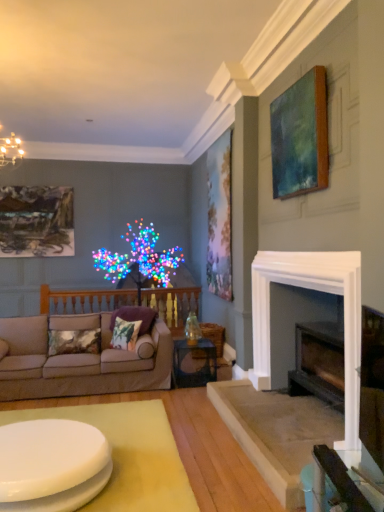
Describe the element at coordinates (219, 217) in the screenshot. The height and width of the screenshot is (512, 384). I see `matte green painting at upper right, which appears as the second picture frame when viewed from the back` at that location.

This screenshot has height=512, width=384. Describe the element at coordinates (74, 341) in the screenshot. I see `textured velvet pillow at lower left, arranged as the 3th pillow when viewed from the right` at that location.

The image size is (384, 512). In order to click on beige fabric couch at left in this screenshot , I will do `click(79, 360)`.

Where is `greenish-blue canvas at upper right, which is the 3th picture frame in left-to-right order`? greenish-blue canvas at upper right, which is the 3th picture frame in left-to-right order is located at coordinates [300, 137].

Who is more distant, green printed fabric pillow at center, which is the second pillow in right-to-left order, or oil painting at upper left, which ranks as the third picture frame in front-to-back order?

Positioned behind is oil painting at upper left, which ranks as the third picture frame in front-to-back order.

From the green printed fabric pillow at center, which is the second pillow in right-to-left order, count 2nd picture frames backward and point to it. Please provide its 2D coordinates.

[(36, 221)]

Does point (112, 341) come closer to viewer compared to point (38, 203)?

Yes, point (112, 341) is in front of point (38, 203).

From the picture: Who is shorter, green printed fabric pillow at center, which ranks as the 2th pillow in left-to-right order, or oil painting at upper left, which ranks as the third picture frame in front-to-back order?

green printed fabric pillow at center, which ranks as the 2th pillow in left-to-right order.

Can you confirm if clear glass table at center is taller than beige fabric couch at left?

Incorrect, the height of clear glass table at center is not larger of that of beige fabric couch at left.

Is clear glass table at center looking in the opposite direction of beige fabric couch at left?

No, clear glass table at center is not facing away from beige fabric couch at left.

Is clear glass table at center at the right side of beige fabric couch at left?

Yes.

Does matte green painting at upper right, which is counted as the second picture frame, starting from the left, come behind clear glass table at center?

Yes.

Who is smaller, matte green painting at upper right, which is counted as the second picture frame, starting from the left, or clear glass table at center?

clear glass table at center is smaller.

Could you measure the distance between matte green painting at upper right, marked as the 2th picture frame in a front-to-back arrangement, and clear glass table at center?

matte green painting at upper right, marked as the 2th picture frame in a front-to-back arrangement, is 4.51 feet away from clear glass table at center.

From a real-world perspective, which is physically below, matte green painting at upper right, positioned as the second picture frame in right-to-left order, or clear glass table at center?

clear glass table at center, from a real-world perspective.

Considering the points (201, 369) and (286, 146), which point is behind, point (201, 369) or point (286, 146)?

The point (201, 369) is farther.

Is clear glass table at center not inside greenish-blue canvas at upper right, which is the 1th picture frame in front-to-back order?

Yes, clear glass table at center is outside of greenish-blue canvas at upper right, which is the 1th picture frame in front-to-back order.

Considering the relative sizes of purple velvet pillow at center, placed as the 1th pillow when sorted from right to left, and green printed fabric pillow at center, which is the second pillow in right-to-left order, in the image provided, is purple velvet pillow at center, placed as the 1th pillow when sorted from right to left, smaller than green printed fabric pillow at center, which is the second pillow in right-to-left order,?

No, purple velvet pillow at center, placed as the 1th pillow when sorted from right to left, is not smaller than green printed fabric pillow at center, which is the second pillow in right-to-left order.

This screenshot has width=384, height=512. I want to click on pillow that is the 1st object to the left of the purple velvet pillow at center, the 3th pillow viewed from the left, starting at the anchor, so click(x=125, y=334).

Considering the relative sizes of purple velvet pillow at center, the 3th pillow viewed from the left, and green printed fabric pillow at center, which is the second pillow in right-to-left order, in the image provided, is purple velvet pillow at center, the 3th pillow viewed from the left, taller than green printed fabric pillow at center, which is the second pillow in right-to-left order,?

Correct, purple velvet pillow at center, the 3th pillow viewed from the left, is much taller as green printed fabric pillow at center, which is the second pillow in right-to-left order.

From a real-world perspective, is purple velvet pillow at center, placed as the 1th pillow when sorted from right to left, positioned under green printed fabric pillow at center, which ranks as the 2th pillow in left-to-right order, based on gravity?

No, from a real-world perspective, purple velvet pillow at center, placed as the 1th pillow when sorted from right to left, is not under green printed fabric pillow at center, which ranks as the 2th pillow in left-to-right order.

Would you say white glossy coffee table at center is inside or outside matte green painting at upper right, marked as the 2th picture frame in a front-to-back arrangement?

white glossy coffee table at center lies outside matte green painting at upper right, marked as the 2th picture frame in a front-to-back arrangement.

Between white glossy coffee table at center and matte green painting at upper right, positioned as the second picture frame in right-to-left order, which one has larger width?

Wider between the two is white glossy coffee table at center.

How different are the orientations of white glossy coffee table at center and matte green painting at upper right, which is counted as the second picture frame, starting from the left, in degrees?

They differ by 1.23 degrees in their facing directions.

How many degrees apart are the facing directions of purple velvet pillow at center, the 3th pillow viewed from the left, and greenish-blue canvas at upper right, which is the 3th picture frame in left-to-right order?

The angular difference between purple velvet pillow at center, the 3th pillow viewed from the left, and greenish-blue canvas at upper right, which is the 3th picture frame in left-to-right order, is 59 degrees.

Considering the points (131, 309) and (312, 184), which point is behind, point (131, 309) or point (312, 184)?

The point (131, 309) is behind.

Image resolution: width=384 pixels, height=512 pixels. I want to click on pillow that is the 1st object located below the greenish-blue canvas at upper right, which is the 1th picture frame in front-to-back order (from the image's perspective), so click(x=135, y=317).

Does purple velvet pillow at center, placed as the 1th pillow when sorted from right to left, have a lesser width compared to greenish-blue canvas at upper right, which is the third picture frame in back-to-front order?

Incorrect, the width of purple velvet pillow at center, placed as the 1th pillow when sorted from right to left, is not less than that of greenish-blue canvas at upper right, which is the third picture frame in back-to-front order.

Where is `picture frame to the left of green printed fabric pillow at center, which ranks as the 2th pillow in left-to-right order`? picture frame to the left of green printed fabric pillow at center, which ranks as the 2th pillow in left-to-right order is located at coordinates (36, 221).

The width and height of the screenshot is (384, 512). Find the location of `studio couch above the clear glass table at center (from the image's perspective)`. studio couch above the clear glass table at center (from the image's perspective) is located at coordinates (79, 360).

Estimate the real-world distances between objects in this image. Which object is closer to white glossy coffee table at center, purple velvet pillow at center, placed as the 1th pillow when sorted from right to left, or beige fabric couch at left?

The object closer to white glossy coffee table at center is beige fabric couch at left.

In the scene shown: Based on their spatial positions, is purple velvet pillow at center, placed as the 1th pillow when sorted from right to left, or green printed fabric pillow at center, which ranks as the 2th pillow in left-to-right order, further from greenish-blue canvas at upper right, which is the 1th picture frame in front-to-back order?

green printed fabric pillow at center, which ranks as the 2th pillow in left-to-right order, is further to greenish-blue canvas at upper right, which is the 1th picture frame in front-to-back order.

Which object lies further to the anchor point greenish-blue canvas at upper right, which is the 3th picture frame in left-to-right order, textured velvet pillow at lower left, arranged as the 3th pillow when viewed from the right, or green printed fabric pillow at center, which ranks as the 2th pillow in left-to-right order?

textured velvet pillow at lower left, arranged as the 3th pillow when viewed from the right, lies further to greenish-blue canvas at upper right, which is the 3th picture frame in left-to-right order, than the other object.

Based on the photo, estimate the real-world distances between objects in this image. Which object is further from matte green painting at upper right, which is counted as the second picture frame, starting from the left, purple velvet pillow at center, the 3th pillow viewed from the left, or white glossy coffee table at center?

white glossy coffee table at center lies further to matte green painting at upper right, which is counted as the second picture frame, starting from the left, than the other object.

From the image, which object appears to be farther from matte green painting at upper right, which appears as the second picture frame when viewed from the back, beige fabric couch at left or textured velvet pillow at lower left, arranged as the 3th pillow when viewed from the right?

The object further to matte green painting at upper right, which appears as the second picture frame when viewed from the back, is textured velvet pillow at lower left, arranged as the 3th pillow when viewed from the right.

Based on their spatial positions, is textured velvet pillow at lower left, arranged as the 3th pillow when viewed from the right, or clear glass table at center further from matte green painting at upper right, positioned as the second picture frame in right-to-left order?

Among the two, textured velvet pillow at lower left, arranged as the 3th pillow when viewed from the right, is located further to matte green painting at upper right, positioned as the second picture frame in right-to-left order.

Based on their spatial positions, is clear glass table at center or matte green painting at upper right, which is counted as the second picture frame, starting from the left, further from textured velvet pillow at lower left, which is the 1th pillow from left to right?

Among the two, matte green painting at upper right, which is counted as the second picture frame, starting from the left, is located further to textured velvet pillow at lower left, which is the 1th pillow from left to right.

Looking at the image, which one is located further to purple velvet pillow at center, the 3th pillow viewed from the left, oil painting at upper left, arranged as the 1th picture frame when viewed from the left, or clear glass table at center?

The object further to purple velvet pillow at center, the 3th pillow viewed from the left, is oil painting at upper left, arranged as the 1th picture frame when viewed from the left.

Image resolution: width=384 pixels, height=512 pixels. Find the location of `pillow between white glossy coffee table at center and textured velvet pillow at lower left, which is the 1th pillow from left to right, from front to back`. pillow between white glossy coffee table at center and textured velvet pillow at lower left, which is the 1th pillow from left to right, from front to back is located at coordinates (125, 334).

Locate an element on the screen. This screenshot has height=512, width=384. table between white glossy coffee table at center and green printed fabric pillow at center, which ranks as the 2th pillow in left-to-right order, along the z-axis is located at coordinates (200, 368).

Where is `studio couch located between white glossy coffee table at center and green printed fabric pillow at center, which ranks as the 2th pillow in left-to-right order, in the depth direction`? studio couch located between white glossy coffee table at center and green printed fabric pillow at center, which ranks as the 2th pillow in left-to-right order, in the depth direction is located at coordinates (79, 360).

Where is `table located between white glossy coffee table at center and oil painting at upper left, which appears as the third picture frame when viewed from the right, in the depth direction`? table located between white glossy coffee table at center and oil painting at upper left, which appears as the third picture frame when viewed from the right, in the depth direction is located at coordinates (200, 368).